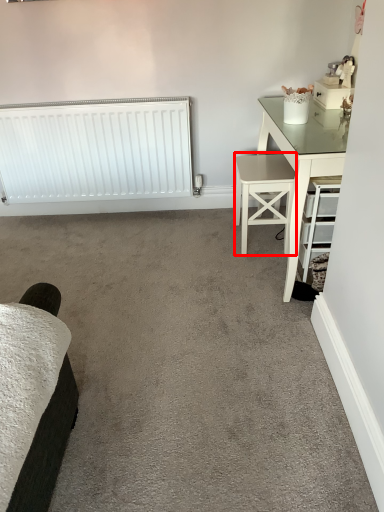
Question: From the image's perspective, where is stool (annotated by the red box) located relative to radiator?

Choices:
 (A) below
 (B) above

Answer: (A)